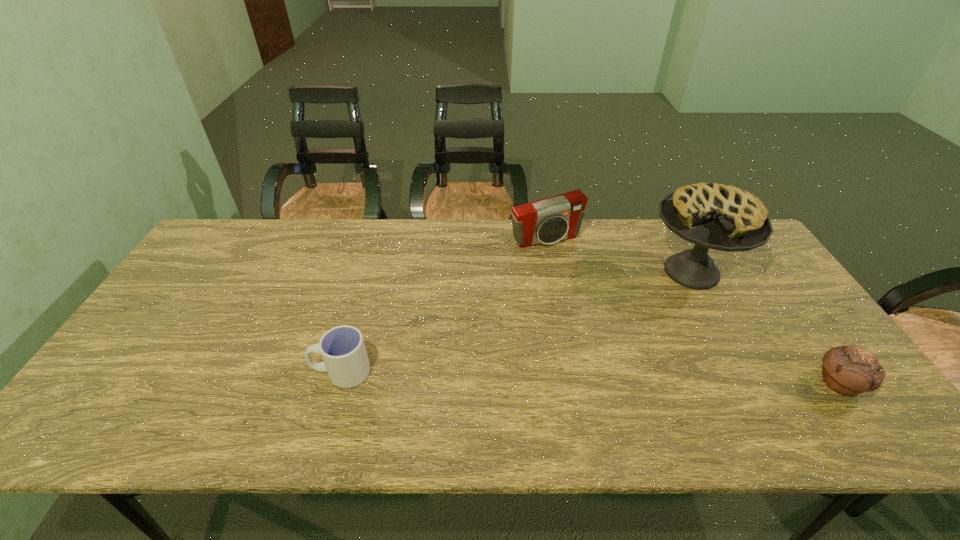
What are the coordinates of `muffin located in the right edge section of the desktop` in the screenshot? It's located at (848, 370).

Identify the location of pie that is at the right edge. (714, 216).

The width and height of the screenshot is (960, 540). Find the location of `object that is at the far right corner`. object that is at the far right corner is located at coordinates (714, 216).

You are a GUI agent. You are given a task and a screenshot of the screen. Output one action in this format:
    pyautogui.click(x=<x>, y=<y>)
    Task: Click on the object that is positioned at the near right corner
    The image size is (960, 540).
    Given the screenshot: What is the action you would take?
    pyautogui.click(x=848, y=370)

Where is `vacant area at the far edge of the desktop`? The width and height of the screenshot is (960, 540). vacant area at the far edge of the desktop is located at coordinates (598, 223).

Where is `vacant area at the near edge`? vacant area at the near edge is located at coordinates (758, 393).

Identify the location of vacant space at the left edge. 172,364.

Find the location of a particular element. free region at the right edge of the desktop is located at coordinates (769, 333).

In the image, there is a desktop. Identify the location of vacant space at the far left corner. This screenshot has height=540, width=960. (248, 255).

Identify the location of free location at the near left corner. The width and height of the screenshot is (960, 540). (119, 375).